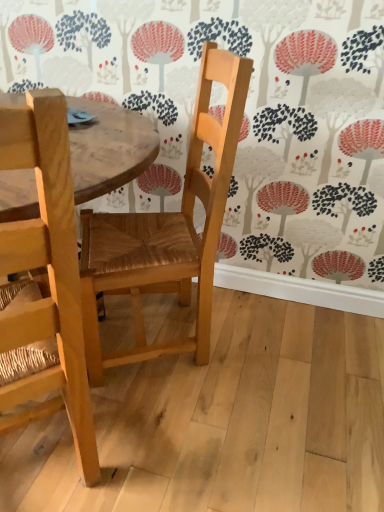
Question: From a real-world perspective, is natural wood chair at center, the 1th chair in the left-to-right sequence, physically located above or below natural wood chair at center, the second chair positioned from the left?

Choices:
 (A) above
 (B) below

Answer: (B)

Question: In terms of size, does natural wood chair at center, the 1th chair in the left-to-right sequence, appear bigger or smaller than natural wood chair at center, the second chair positioned from the left?

Choices:
 (A) small
 (B) big

Answer: (A)

Question: In terms of height, does natural wood chair at center, the 1th chair in the left-to-right sequence, look taller or shorter compared to natural wood chair at center, the second chair positioned from the left?

Choices:
 (A) short
 (B) tall

Answer: (B)

Question: Looking at their shapes, would you say natural wood chair at center, the first chair from the right, is wider or thinner than natural wood chair at center, which is counted as the second chair, starting from the right?

Choices:
 (A) wide
 (B) thin

Answer: (B)

Question: From their relative heights in the image, would you say natural wood chair at center, the second chair positioned from the left, is taller or shorter than natural wood chair at center, the 1th chair in the left-to-right sequence?

Choices:
 (A) tall
 (B) short

Answer: (B)

Question: Would you say natural wood chair at center, the first chair from the right, is to the left or to the right of natural wood chair at center, which is counted as the second chair, starting from the right, in the picture?

Choices:
 (A) left
 (B) right

Answer: (B)

Question: Looking at the image, does natural wood chair at center, the first chair from the right, seem bigger or smaller compared to natural wood chair at center, the 1th chair in the left-to-right sequence?

Choices:
 (A) big
 (B) small

Answer: (A)